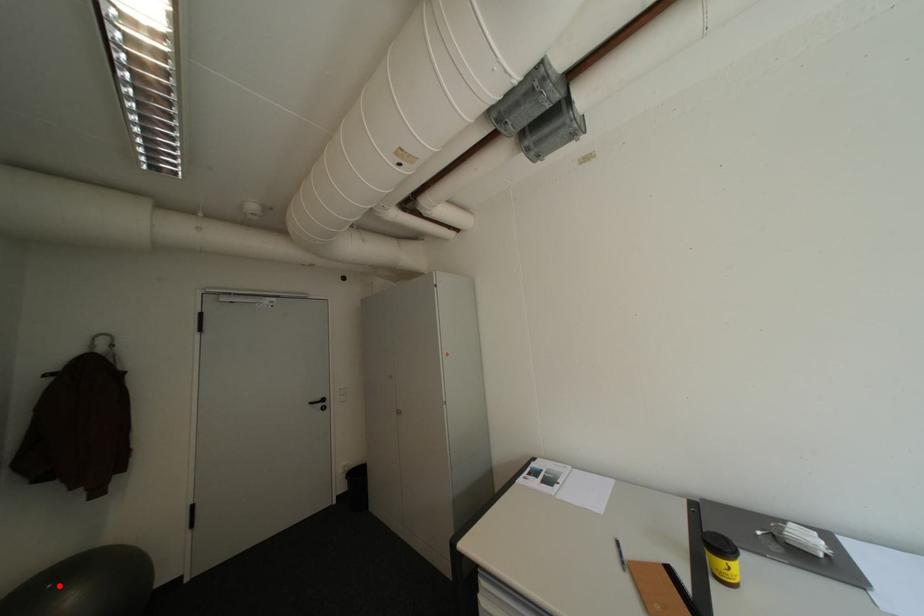
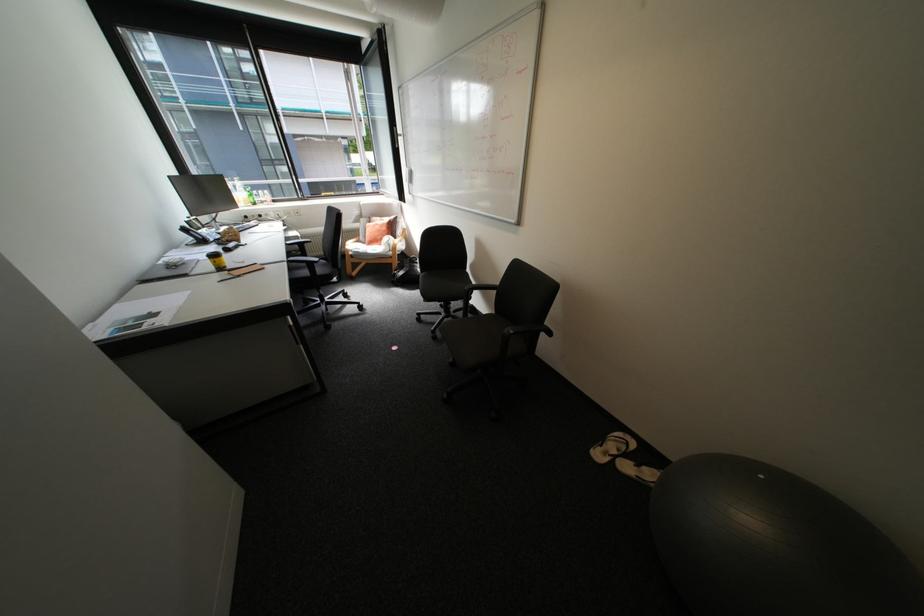
In the second image, find the point that corresponds to the highlighted location in the first image.

(772, 477)